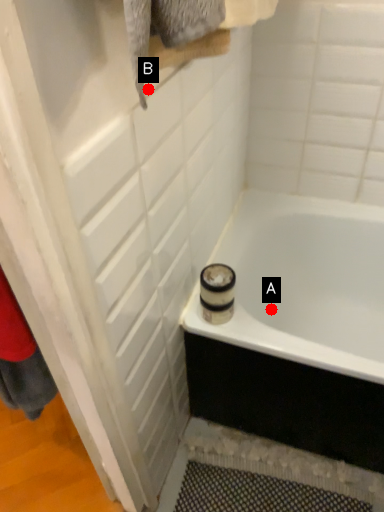
Question: Two points are circled on the image, labeled by A and B beside each circle. Which of the following is the closest to the observer?

Choices:
 (A) A is closer
 (B) B is closer

Answer: (B)